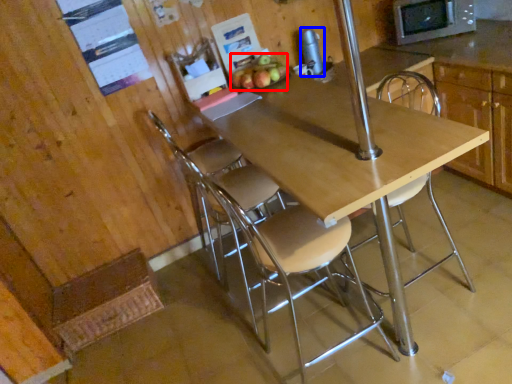
Question: Among these objects, which one is nearest to the camera, apple (highlighted by a red box) or appliance (highlighted by a blue box)?

Choices:
 (A) apple
 (B) appliance

Answer: (A)